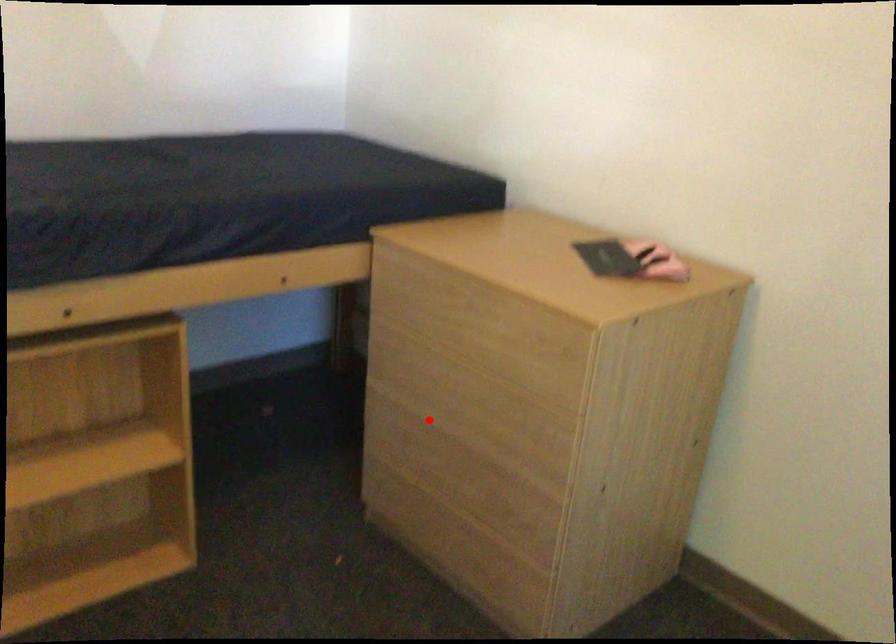
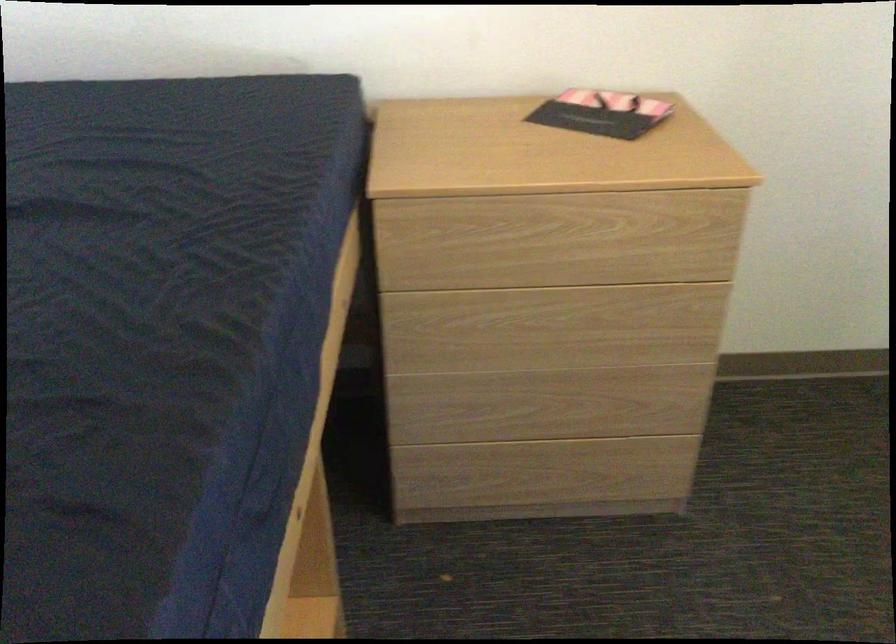
In the second image, find the point that corresponds to the highlighted location in the first image.

(518, 368)